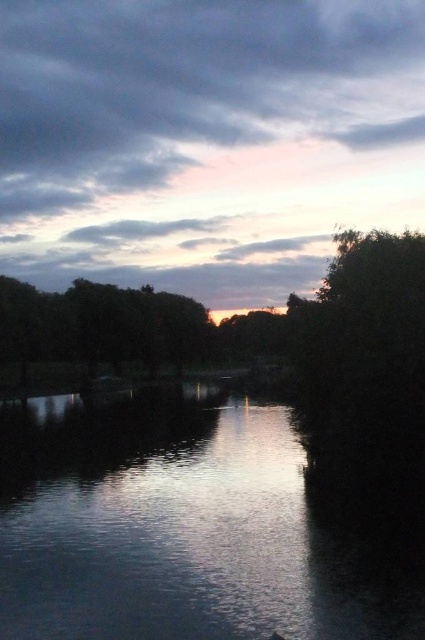
Question: Considering the real-world distances, which object is closest to the green leafy tree at center?

Choices:
 (A) smooth water at center
 (B) pastel sky at center

Answer: (A)

Question: From the image, what is the correct spatial relationship of pastel sky at center in relation to green leafy tree at center?

Choices:
 (A) right
 (B) left

Answer: (A)

Question: Is pastel sky at center to the right of smooth water at center from the viewer's perspective?

Choices:
 (A) yes
 (B) no

Answer: (B)

Question: Which point appears closest to the camera in this image?

Choices:
 (A) (153, 17)
 (B) (297, 506)
 (C) (238, 326)

Answer: (B)

Question: Which point is closer to the camera?

Choices:
 (A) (396, 266)
 (B) (76, 497)

Answer: (B)

Question: In this image, where is pastel sky at center located relative to smooth water at center?

Choices:
 (A) left
 (B) right

Answer: (A)